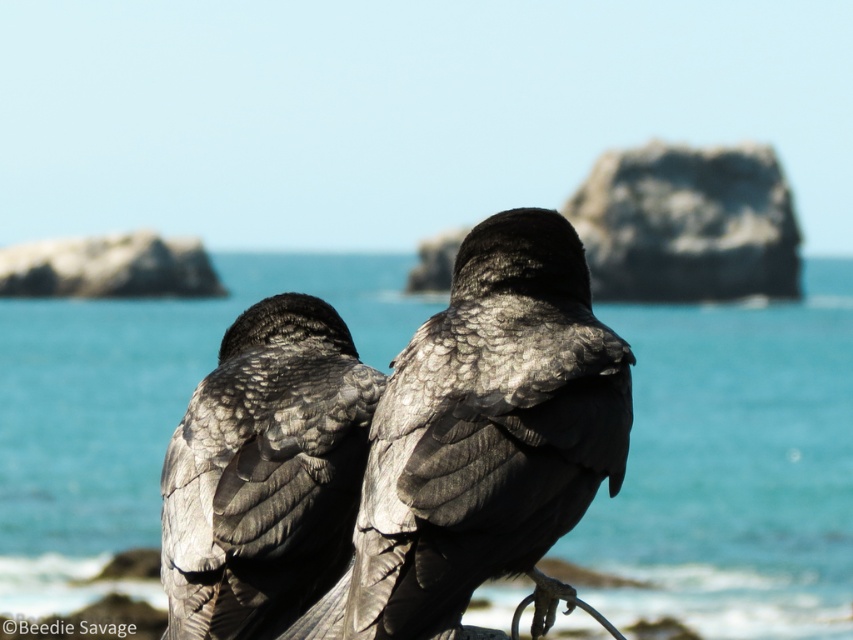
You are a bird watching enthusiast observing the two birds in the image. You notice a point at coordinates (734, 465). Which object from the scene is located at this point?

The blue water at center is located at point (734, 465).

In the scene shown: You are a birdwatcher observing the two birds at the center of the image. You notice a specific point marked at coordinates (485,435). What is located at this point?

At point (485,435) lies a shiny black raven at center.